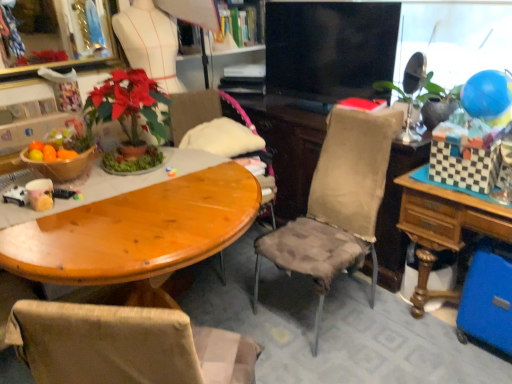
Where is `blue rubber balloon at upper right`? Image resolution: width=512 pixels, height=384 pixels. blue rubber balloon at upper right is located at coordinates (487, 97).

Describe the element at coordinates (330, 49) in the screenshot. I see `black glossy tv at center` at that location.

In order to click on wooden table at center in this screenshot , I will do `click(124, 245)`.

From a real-world perspective, does textured beige chair at center, the second chair positioned from the back, stand above wooden table at right?

Yes, from a real-world perspective, textured beige chair at center, the second chair positioned from the back, is above wooden table at right.

Which object is positioned more to the left, textured beige chair at center, the second chair positioned from the back, or wooden table at right?

textured beige chair at center, the second chair positioned from the back, is more to the left.

Does point (359, 200) lie in front of point (490, 202)?

No, it is behind (490, 202).

How different are the orientations of textured beige chair at center, the 1th chair in the front-to-back sequence, and wooden table at right in degrees?

They differ by 41.4 degrees in their facing directions.

Is wooden chair at center, the first chair positioned from the back, located within textured beige chair at center, the 1th chair in the front-to-back sequence?

Actually, wooden chair at center, the first chair positioned from the back, is outside textured beige chair at center, the 1th chair in the front-to-back sequence.

Is point (341, 249) closer to viewer compared to point (253, 127)?

That is True.

From a real-world perspective, is textured beige chair at center, the 1th chair in the front-to-back sequence, located higher than wooden chair at center, the first chair positioned from the back?

No, from a real-world perspective, textured beige chair at center, the 1th chair in the front-to-back sequence, is not above wooden chair at center, the first chair positioned from the back.

Is blue rubber balloon at upper right at the right side of textured beige chair at center, the 1th chair in the front-to-back sequence?

Yes, blue rubber balloon at upper right is to the right of textured beige chair at center, the 1th chair in the front-to-back sequence.

From a real-world perspective, is blue rubber balloon at upper right under textured beige chair at center, the second chair positioned from the back?

→ Incorrect, from a real-world perspective, blue rubber balloon at upper right is higher than textured beige chair at center, the second chair positioned from the back.

Considering the sizes of blue rubber balloon at upper right and textured beige chair at center, the 1th chair in the front-to-back sequence, in the image, is blue rubber balloon at upper right bigger or smaller than textured beige chair at center, the 1th chair in the front-to-back sequence,?

Considering their sizes, blue rubber balloon at upper right takes up less space than textured beige chair at center, the 1th chair in the front-to-back sequence.

I want to click on table directly beneath the wooden chair at center, the 2th chair from the front (from a real-world perspective), so click(x=444, y=228).

Considering the sizes of objects wooden table at right and wooden chair at center, the first chair positioned from the back, in the image provided, who is smaller, wooden table at right or wooden chair at center, the first chair positioned from the back,?

wooden chair at center, the first chair positioned from the back, is smaller.

Choose the correct answer: Is wooden table at right inside wooden chair at center, the 2th chair from the front, or outside it?

wooden table at right is located beyond the bounds of wooden chair at center, the 2th chair from the front.

From a real-world perspective, between black glossy tv at center and wooden table at right, who is vertically lower?

A: wooden table at right, from a real-world perspective.

From the image's perspective, which one is positioned lower, black glossy tv at center or wooden table at right?

From the image's view, wooden table at right is below.

Considering the relative positions of black glossy tv at center and wooden table at right in the image provided, is black glossy tv at center in front of wooden table at right?

No, black glossy tv at center is behind wooden table at right.

Is black glossy tv at center spatially inside wooden table at right, or outside of it?

The correct answer is: outside.

Is point (511, 228) farther from camera compared to point (101, 175)?

No, (511, 228) is in front of (101, 175).

From the image's perspective, which object appears higher, wooden table at right or wooden table at center?

wooden table at right appears higher in the image.

Considering the relative sizes of wooden table at right and wooden table at center in the image provided, is wooden table at right wider than wooden table at center?

In fact, wooden table at right might be narrower than wooden table at center.

From a real-world perspective, which is physically below, wooden table at right or wooden table at center?

From a 3D spatial view, wooden table at right is below.

Measure the distance from textured beige chair at center, the 1th chair in the front-to-back sequence, to black glossy tv at center.

textured beige chair at center, the 1th chair in the front-to-back sequence, is 25.58 inches from black glossy tv at center.

Which is closer, [358,195] or [302,95]?

The point [358,195] is closer.

Would you consider textured beige chair at center, the second chair positioned from the back, to be distant from black glossy tv at center?

textured beige chair at center, the second chair positioned from the back, is actually quite close to black glossy tv at center.

This screenshot has width=512, height=384. What are the coordinates of `the 1st chair counting from the left of the wooden table at right` in the screenshot? It's located at (337, 205).

In order to click on chair located on the right of wooden chair at center, the first chair positioned from the back in this screenshot , I will do `click(337, 205)`.

Based on the photo, considering their positions, is blue rubber balloon at upper right positioned closer to wooden chair at center, the first chair positioned from the back, than textured beige chair at center, the 1th chair in the front-to-back sequence?

textured beige chair at center, the 1th chair in the front-to-back sequence, is closer to wooden chair at center, the first chair positioned from the back.

Based on their spatial positions, is black glossy tv at center or wooden table at center closer to wooden table at right?

black glossy tv at center.

Estimate the real-world distances between objects in this image. Which object is closer to wooden table at right, black glossy tv at center or wooden chair at center, the 2th chair from the front?

black glossy tv at center is positioned closer to the anchor wooden table at right.

When comparing their distances from wooden chair at center, the 2th chair from the front, does black glossy tv at center or wooden table at center seem closer?

The object closer to wooden chair at center, the 2th chair from the front, is black glossy tv at center.

Looking at the image, which one is located closer to black glossy tv at center, wooden table at right or wooden chair at center, the 2th chair from the front?

Among the two, wooden chair at center, the 2th chair from the front, is located nearer to black glossy tv at center.

Estimate the real-world distances between objects in this image. Which object is further from wooden chair at center, the 2th chair from the front, blue rubber balloon at upper right or wooden table at right?

Among the two, blue rubber balloon at upper right is located further to wooden chair at center, the 2th chair from the front.

Estimate the real-world distances between objects in this image. Which object is further from wooden table at center, wooden chair at center, the 2th chair from the front, or blue rubber balloon at upper right?

Among the two, blue rubber balloon at upper right is located further to wooden table at center.

Which object lies further to the anchor point textured beige chair at center, the 1th chair in the front-to-back sequence, blue rubber balloon at upper right or wooden chair at center, the 2th chair from the front?

wooden chair at center, the 2th chair from the front.

Find the location of a particular element. television between wooden table at center and wooden table at right in the horizontal direction is located at coordinates (330, 49).

The width and height of the screenshot is (512, 384). I want to click on table between textured beige chair at center, the second chair positioned from the back, and blue rubber balloon at upper right, so click(x=444, y=228).

Image resolution: width=512 pixels, height=384 pixels. What are the coordinates of `chair between wooden chair at center, the 2th chair from the front, and wooden table at right from left to right` in the screenshot? It's located at (337, 205).

You are a GUI agent. You are given a task and a screenshot of the screen. Output one action in this format:
    pyautogui.click(x=<x>, y=<y>)
    Task: Click on the television between wooden chair at center, the first chair positioned from the back, and blue rubber balloon at upper right, in the horizontal direction
    
    Given the screenshot: What is the action you would take?
    pyautogui.click(x=330, y=49)